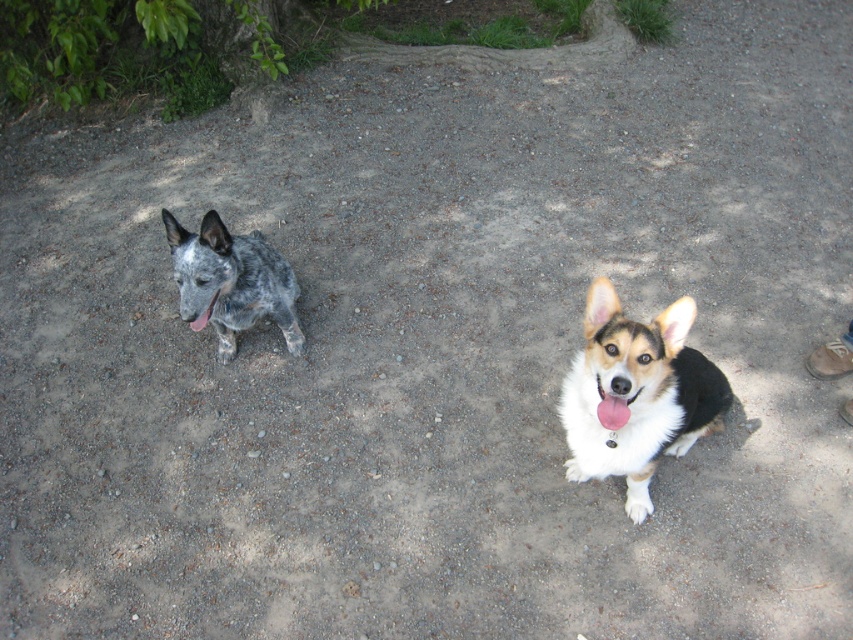
You are a photographer trying to capture a closeup shot of the pink glossy tongue at left while ensuring the speckled fur dog at left is still partially visible in the frame. Given their sizes, will you need to adjust your camera angle to include both?

The speckled fur dog at left is larger than the pink glossy tongue at left, so you can adjust your camera angle to include both without needing to zoom out excessively.